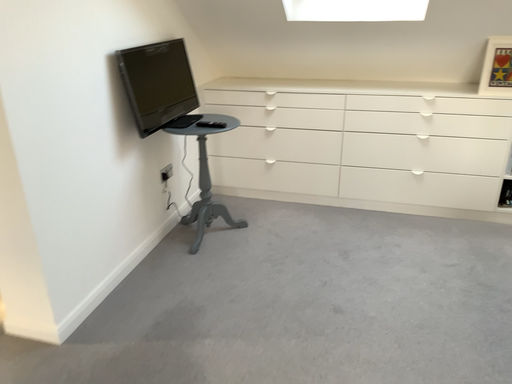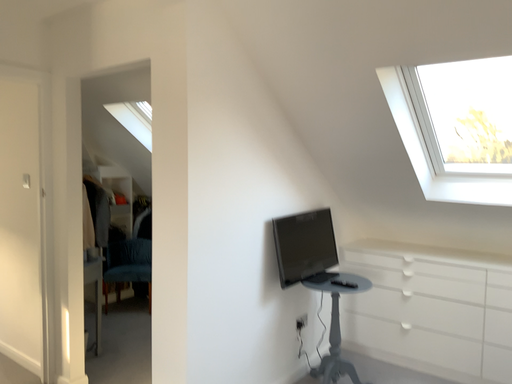
Question: Which way did the camera rotate in the video?

Choices:
 (A) rotated left
 (B) rotated right

Answer: (A)